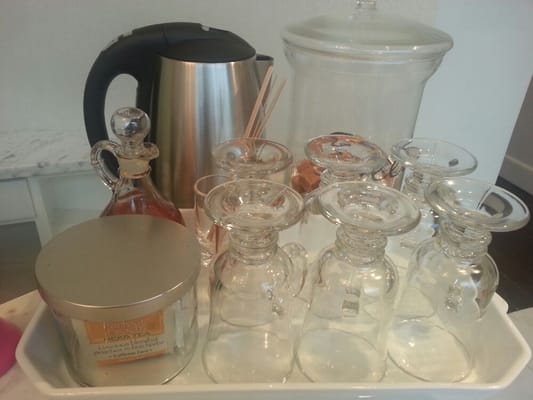
Find the location of a particular element. The width and height of the screenshot is (533, 400). tray is located at coordinates (195, 376).